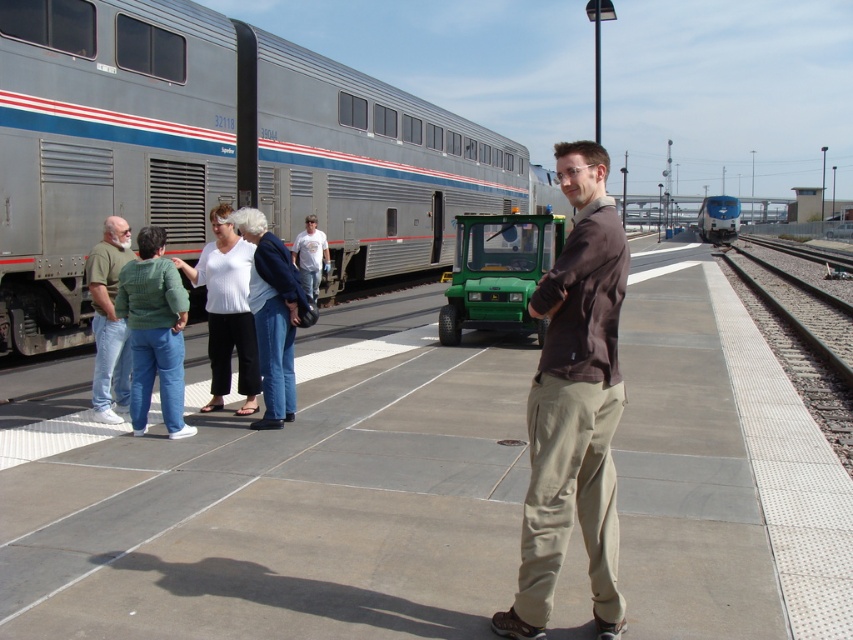
Question: Which point appears farthest from the camera in this image?

Choices:
 (A) (317, 234)
 (B) (143, 358)
 (C) (119, 266)

Answer: (A)

Question: Can you confirm if silver metallic train at left is positioned to the left of green matte utility vehicle at center?

Choices:
 (A) yes
 (B) no

Answer: (A)

Question: Can you confirm if denim jacket at center is thinner than polished blue train at right?

Choices:
 (A) yes
 (B) no

Answer: (A)

Question: Is brown cotton shirt at center thinner than green matte utility vehicle at center?

Choices:
 (A) yes
 (B) no

Answer: (A)

Question: Estimate the real-world distances between objects in this image. Which object is farther from the denim jacket at center?

Choices:
 (A) green cotton shirt at left
 (B) polished blue train at right
 (C) concrete platform at center

Answer: (B)

Question: Which point is farther from the camera taking this photo?

Choices:
 (A) (569, 161)
 (B) (173, 294)

Answer: (B)